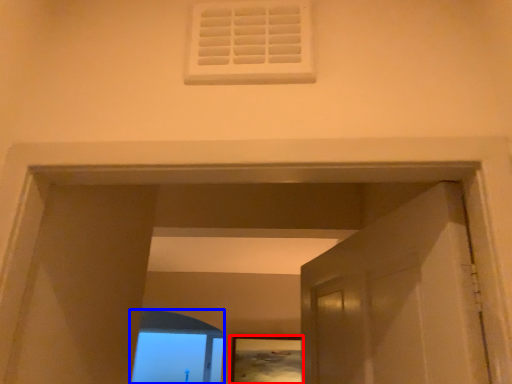
Question: Which of the following is the farthest to the observer, picture frame (highlighted by a red box) or window frame (highlighted by a blue box)?

Choices:
 (A) picture frame
 (B) window frame

Answer: (B)